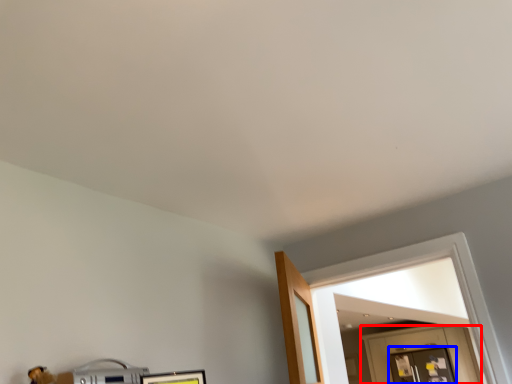
Question: Among these objects, which one is farthest to the camera, door (highlighted by a red box) or glass door (highlighted by a blue box)?

Choices:
 (A) door
 (B) glass door

Answer: (B)